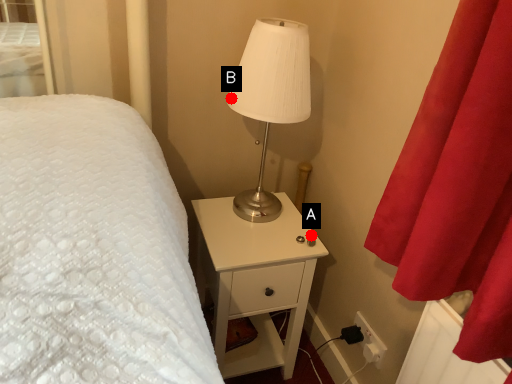
Question: Two points are circled on the image, labeled by A and B beside each circle. Which point is farther to the camera?

Choices:
 (A) A is further
 (B) B is further

Answer: (A)